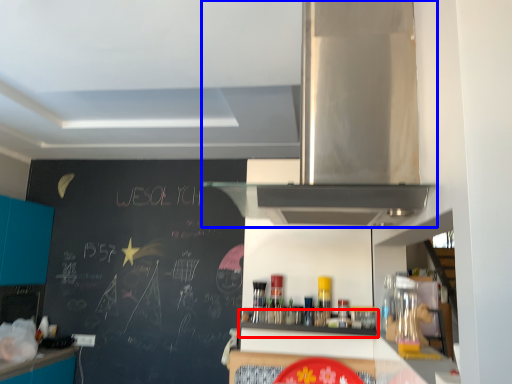
Question: Among these objects, which one is farthest to the camera, shelf (highlighted by a red box) or home appliance (highlighted by a blue box)?

Choices:
 (A) shelf
 (B) home appliance

Answer: (A)